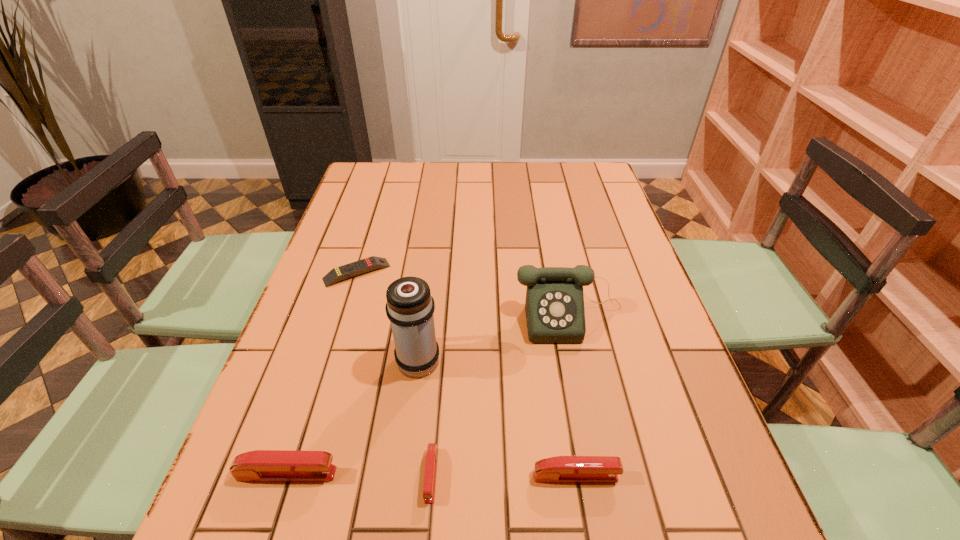
Locate an element on the screen. free space that is in between the rightmost stapler and the telephone is located at coordinates (572, 396).

Identify the location of free space between the tallest object and the leftmost stapler. The height and width of the screenshot is (540, 960). click(x=353, y=416).

This screenshot has height=540, width=960. Find the location of `free space between the telephone and the leftmost stapler`. free space between the telephone and the leftmost stapler is located at coordinates (428, 395).

Locate an element on the screen. This screenshot has width=960, height=540. vacant area between the shortest object and the rightmost stapler is located at coordinates (467, 374).

The height and width of the screenshot is (540, 960). I want to click on empty space that is in between the second tallest stapler and the fifth tallest object, so click(503, 475).

Image resolution: width=960 pixels, height=540 pixels. In order to click on unoccupied position between the second shortest object and the thermos bottle in this screenshot , I will do `click(424, 417)`.

Identify the location of object identified as the closest to the leftmost stapler. (431, 456).

Find the location of a particular element. This screenshot has width=960, height=540. the second closest object relative to the thermos bottle is located at coordinates (554, 306).

Locate an element on the screen. This screenshot has height=540, width=960. stapler object that ranks as the third closest to the telephone is located at coordinates [261, 465].

Locate an element on the screen. This screenshot has height=540, width=960. stapler that is the second closest to the thermos bottle is located at coordinates (261, 465).